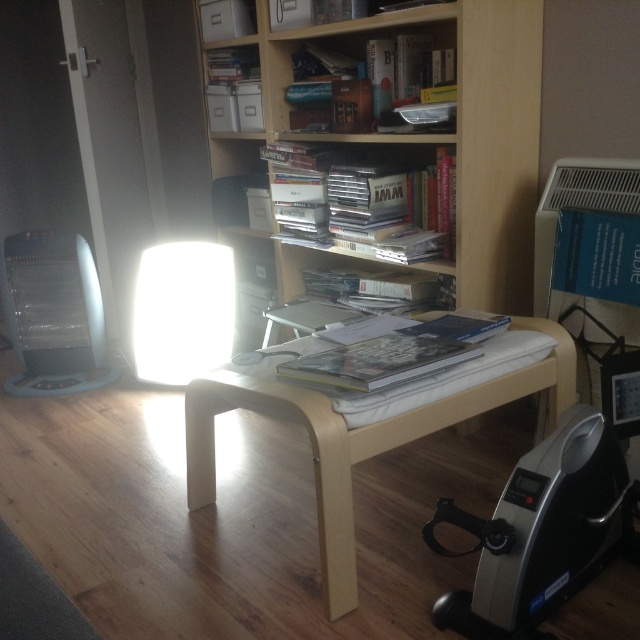
You are standing in front of the table and want to place a small object on the table. You have two points to choose from on the table surface. The first point is at coordinates point (472, 198), and the second is at point (179, 385). Which point is closer to you if you are facing the table directly?

Point (472, 198) is closer to the camera than point (179, 385), so if you are facing the table directly, the first point at coordinates point (472, 198) is closer to you.